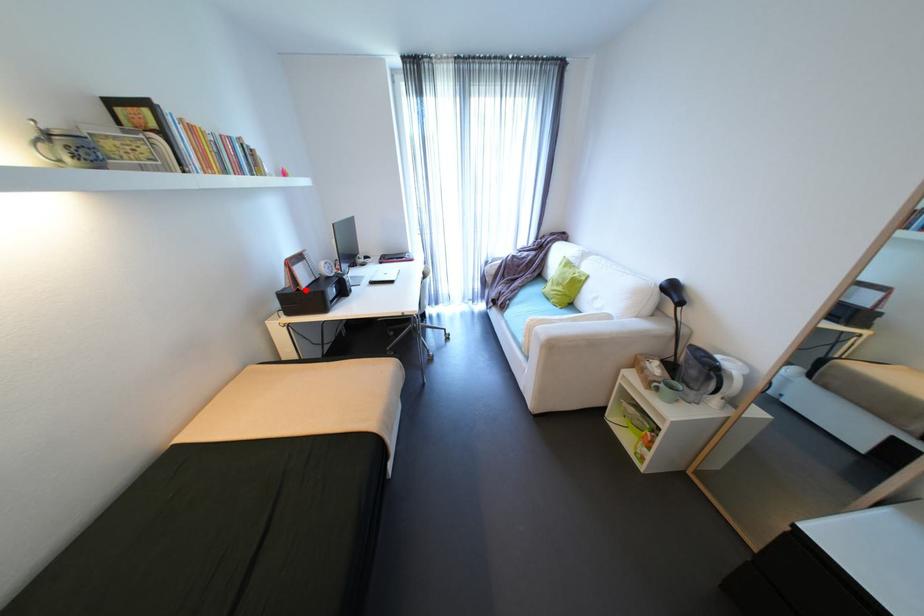
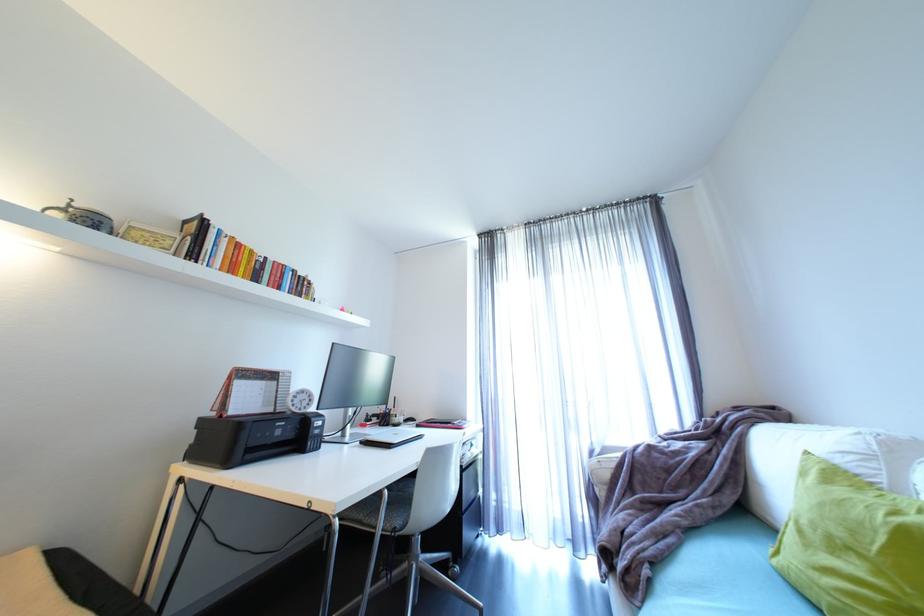
The point at the highlighted location is marked in the first image. Where is the corresponding point in the second image?

(228, 416)